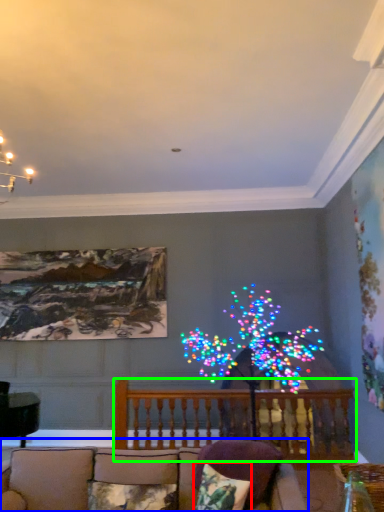
Question: Estimate the real-world distances between objects in this image. Which object is closer to pillow (highlighted by a red box), studio couch (highlighted by a blue box) or balcony (highlighted by a green box)?

Choices:
 (A) studio couch
 (B) balcony

Answer: (A)